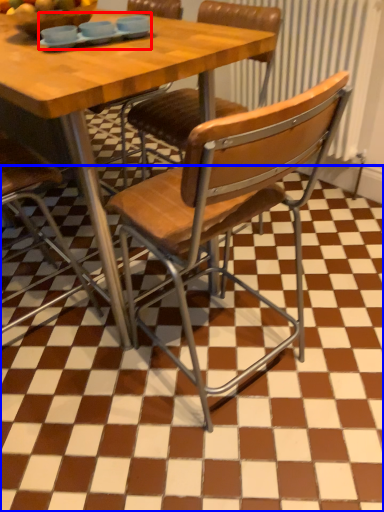
Question: Which object appears farthest to the camera in this image, tableware (highlighted by a red box) or tile (highlighted by a blue box)?

Choices:
 (A) tableware
 (B) tile

Answer: (A)